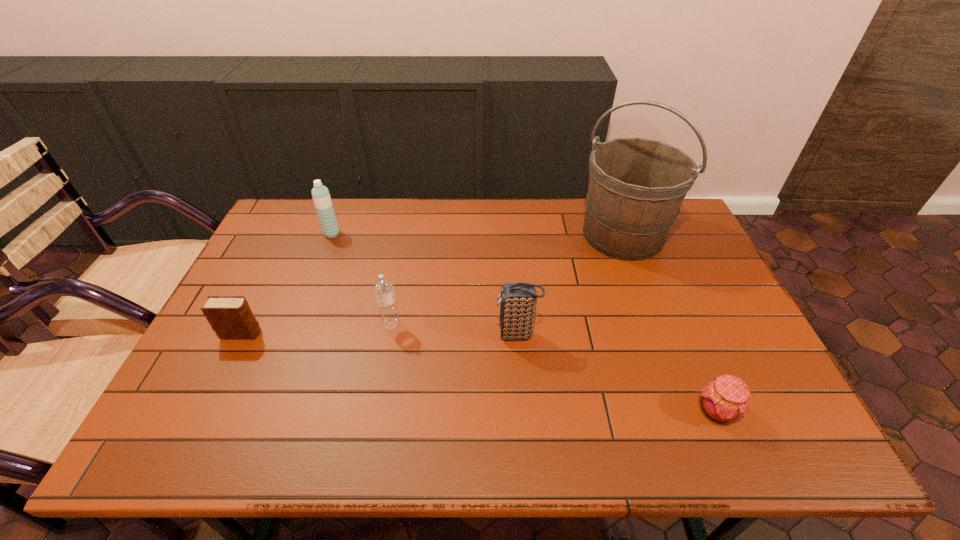
Image resolution: width=960 pixels, height=540 pixels. Identify the location of object that is the fourth nearest to the left water bottle. (636, 187).

Find the location of a particular element. Image resolution: width=960 pixels, height=540 pixels. object that stands as the closest to the bucket is located at coordinates (518, 301).

At what (x,y) coordinates should I click in order to perform the action: click on vacant area that satisfies the following two spatial constraints: 1. on the spine side of the leftmost object; 2. on the back side of the nearest object. Please return your answer as a coordinate pair (x, y). This screenshot has height=540, width=960. Looking at the image, I should click on (204, 411).

Where is `free space that satisfies the following two spatial constraints: 1. with the zip open on the shortest object; 2. on the right side of the clutch bag`? This screenshot has height=540, width=960. free space that satisfies the following two spatial constraints: 1. with the zip open on the shortest object; 2. on the right side of the clutch bag is located at coordinates (523, 411).

Locate an element on the screen. The height and width of the screenshot is (540, 960). free space that satisfies the following two spatial constraints: 1. on the front side of the left water bottle; 2. on the left side of the bucket is located at coordinates (331, 235).